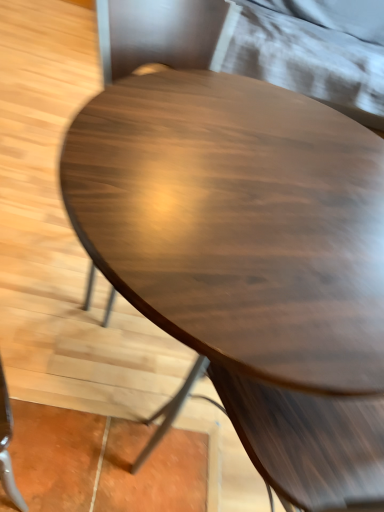
Locate an element on the screen. dark wood coffee table at center is located at coordinates (249, 260).

What do you see at coordinates (249, 260) in the screenshot? I see `dark wood coffee table at center` at bounding box center [249, 260].

The height and width of the screenshot is (512, 384). Find the location of `dark wood coffee table at center`. dark wood coffee table at center is located at coordinates (249, 260).